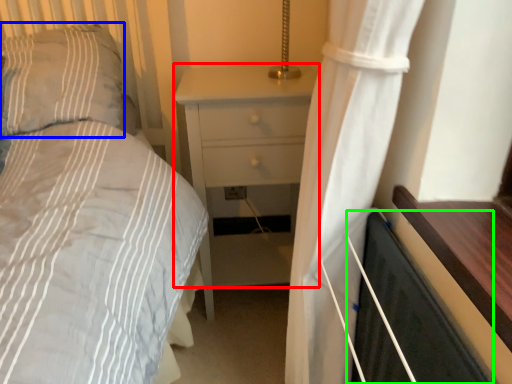
Question: Based on their relative distances, which object is farther from nightstand (highlighted by a red box)? Choose from pillow (highlighted by a blue box) and screen door (highlighted by a green box).

Choices:
 (A) pillow
 (B) screen door

Answer: (B)